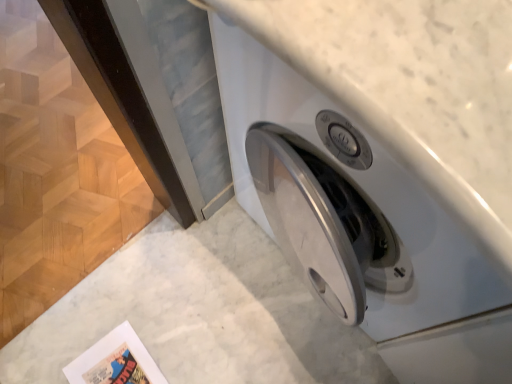
Where is `blank space above matte paper comic book at lower left (from a real-world perspective)`? The image size is (512, 384). blank space above matte paper comic book at lower left (from a real-world perspective) is located at coordinates (116, 365).